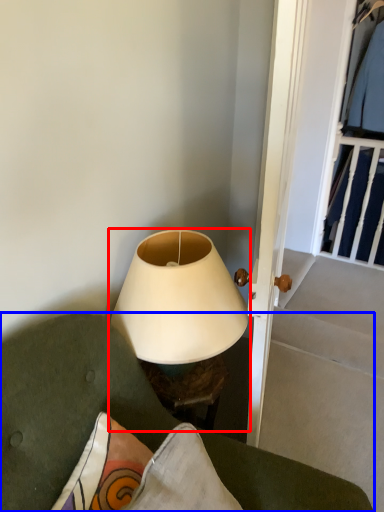
Question: Which object appears closest to the camera in this image, lamp (highlighted by a red box) or furniture (highlighted by a blue box)?

Choices:
 (A) lamp
 (B) furniture

Answer: (B)